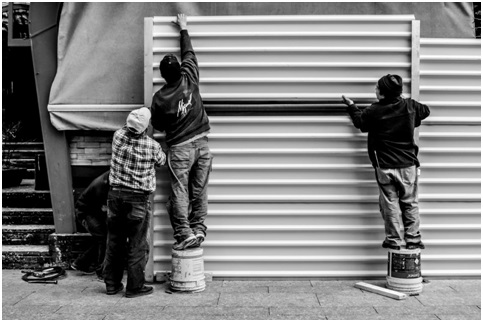
Identify the location of floor. This screenshot has width=483, height=322. (352, 300).